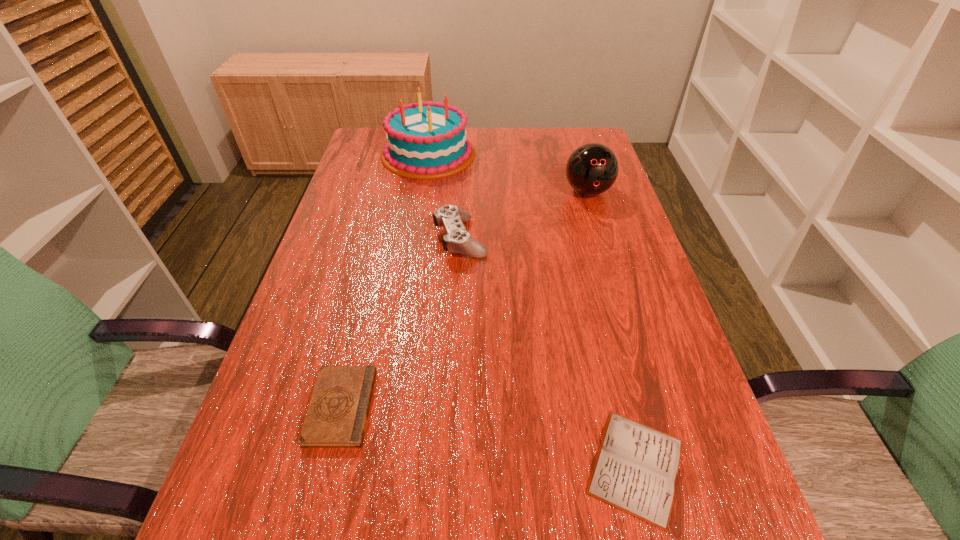
I want to click on birthday cake, so click(x=426, y=140).

The width and height of the screenshot is (960, 540). What are the coordinates of `bowling ball` in the screenshot? It's located at pyautogui.click(x=591, y=169).

In order to click on the third nearest object in this screenshot , I will do `click(457, 239)`.

I want to click on the third shortest object, so point(457,239).

I want to click on the taller diary, so click(x=337, y=415).

I want to click on the second shortest object, so click(337, 415).

Locate an element on the screen. The height and width of the screenshot is (540, 960). the right diary is located at coordinates (x=636, y=468).

This screenshot has width=960, height=540. Find the location of `the shorter diary`. the shorter diary is located at coordinates (636, 468).

Locate an element on the screen. The width and height of the screenshot is (960, 540). vacant space located 0.170m on the right of the birthday cake is located at coordinates (531, 153).

This screenshot has width=960, height=540. Identify the location of vacant space located 0.170m on the surface of the second tallest object near the finger holes. (x=605, y=247).